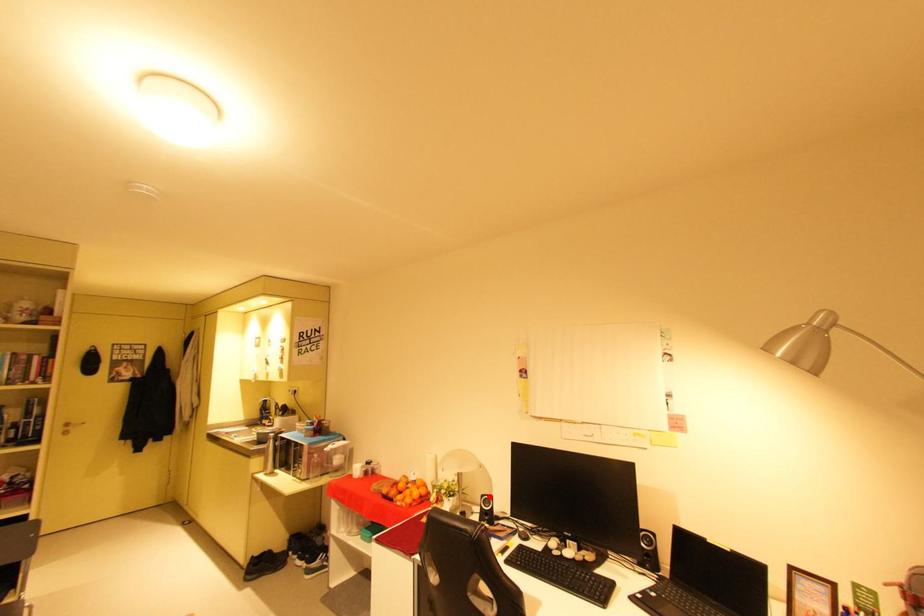
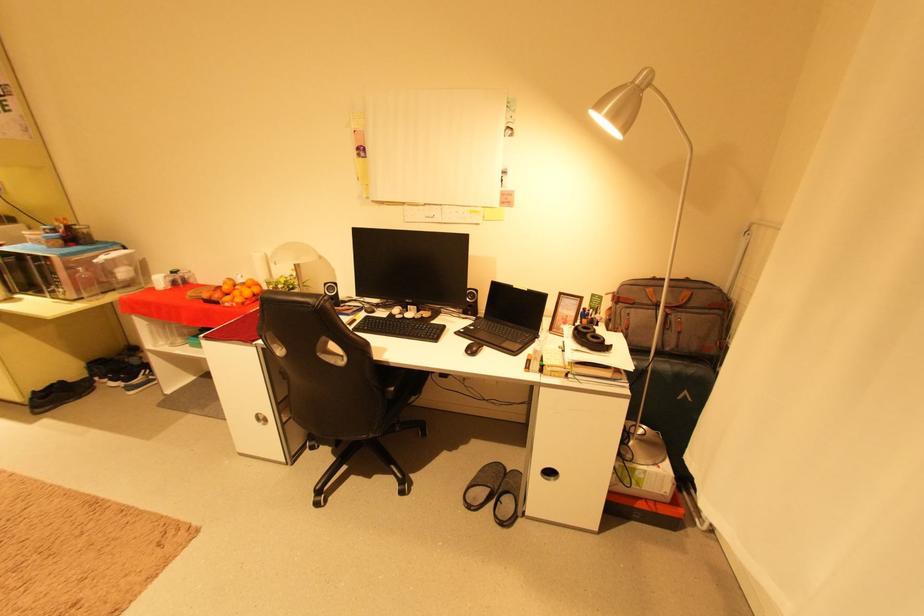
Question: I am providing you with two images of the same scene from different viewpoints. Image1 has a red point marked. In image2, the corresponding 3D location appears at what relative position? Reply with the corresponding letter.

Choices:
 (A) Closer
 (B) Farther

Answer: (A)